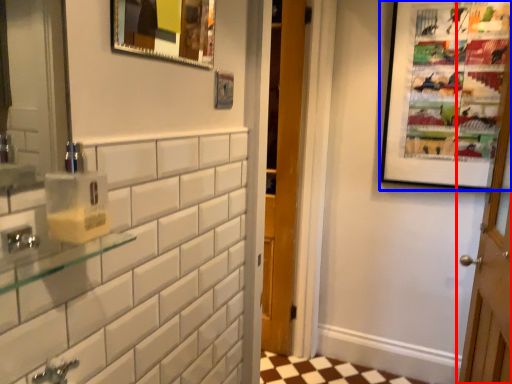
Question: Which object is further to the camera taking this photo, door (highlighted by a red box) or picture frame (highlighted by a blue box)?

Choices:
 (A) door
 (B) picture frame

Answer: (B)